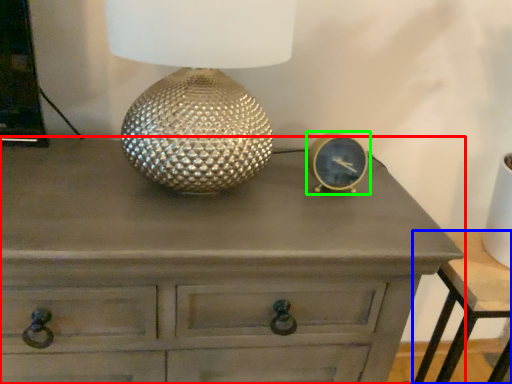
Question: Which is farther away from chest of drawers (highlighted by a red box)? nightstand (highlighted by a blue box) or pocket watch (highlighted by a green box)?

Choices:
 (A) nightstand
 (B) pocket watch

Answer: (A)